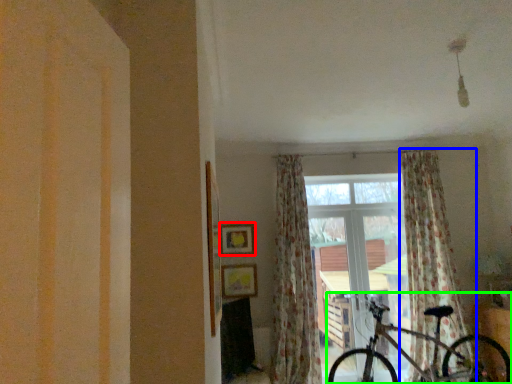
Question: Which is farther away from picture frame (highlighted by a red box)? curtain (highlighted by a blue box) or bicycle (highlighted by a green box)?

Choices:
 (A) curtain
 (B) bicycle

Answer: (A)